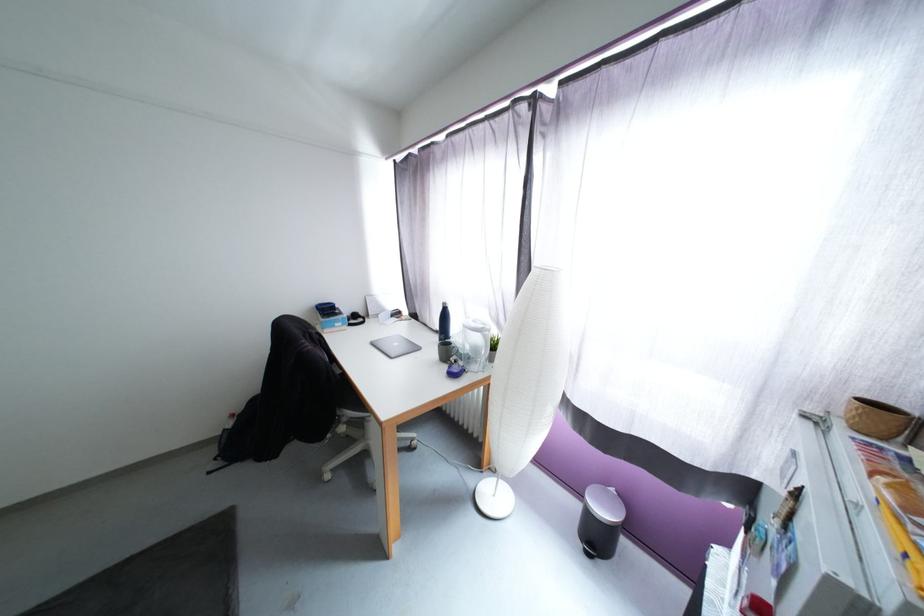
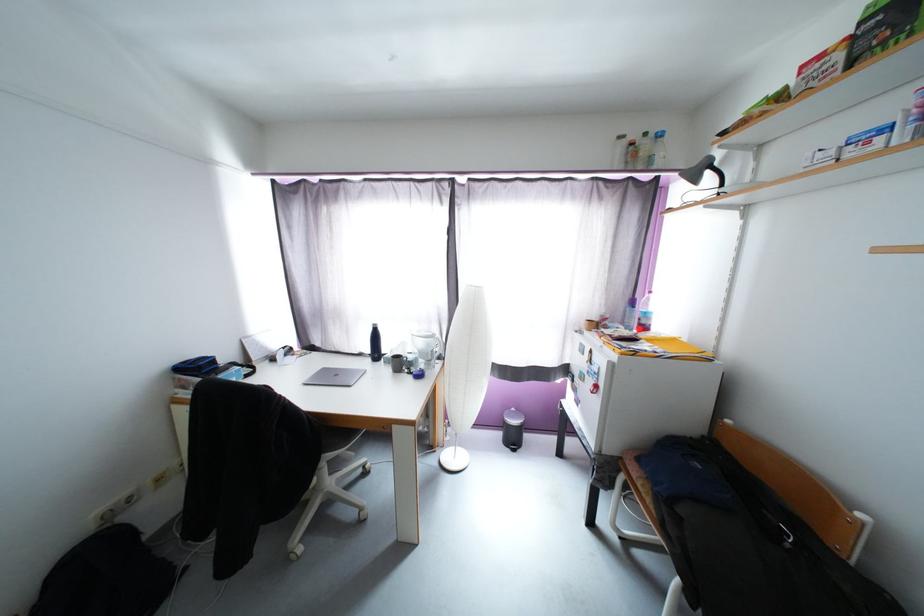
The point at (478, 488) is marked in the first image. Where is the corresponding point in the second image?

(442, 464)